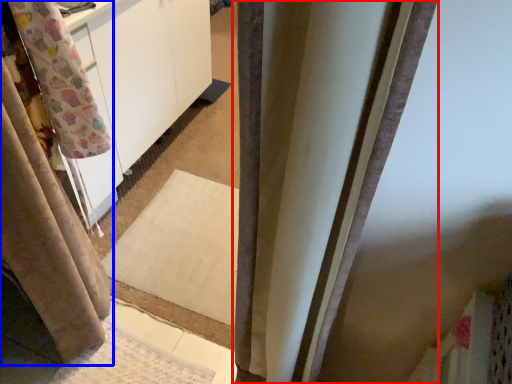
Question: Which object appears closest to the camera in this image, curtain (highlighted by a red box) or curtain (highlighted by a blue box)?

Choices:
 (A) curtain
 (B) curtain

Answer: (A)